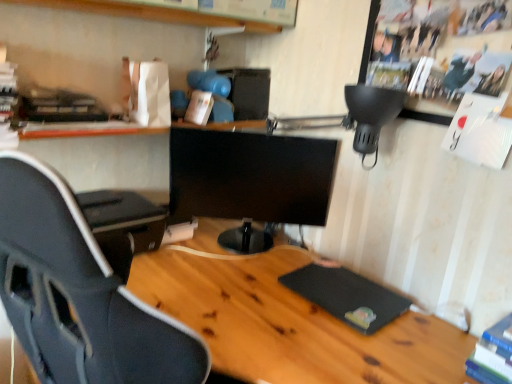
At what (x,y) coordinates should I click in order to perform the action: click on vacant area that is in front of black glossy monitor at center. Please return your answer as a coordinate pair (x, y). The width and height of the screenshot is (512, 384). Looking at the image, I should click on (239, 292).